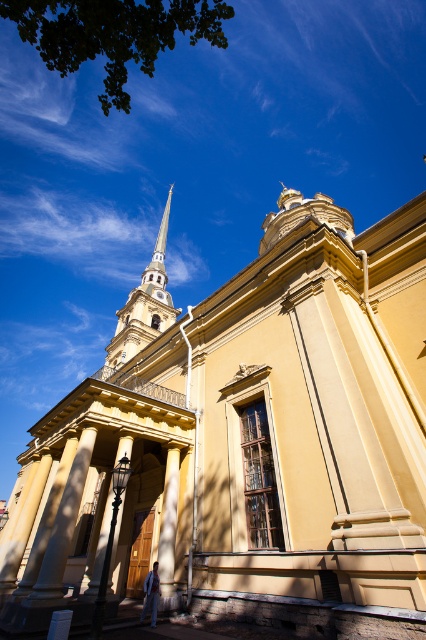
Question: Does yellow matte church at center have a lesser width compared to polished silver spire at upper center?

Choices:
 (A) no
 (B) yes

Answer: (A)

Question: Which object is positioned closest to the smooth beige column at lower left?

Choices:
 (A) smooth beige pillar at center
 (B) polished silver spire at upper center
 (C) yellow matte church at center

Answer: (A)

Question: Which point appears farthest from the camera in this image?

Choices:
 (A) (163, 518)
 (B) (138, 324)
 (C) (68, 538)
 (D) (158, 237)

Answer: (D)

Question: Can you confirm if yellow matte church at center is bigger than golden spire at upper left?

Choices:
 (A) yes
 (B) no

Answer: (B)

Question: Among these points, which one is nearest to the camera?

Choices:
 (A) (x=149, y=285)
 (B) (x=319, y=528)

Answer: (B)

Question: In this image, where is smooth beige column at lower left located relative to smooth beige pillar at center?

Choices:
 (A) above
 (B) below

Answer: (A)